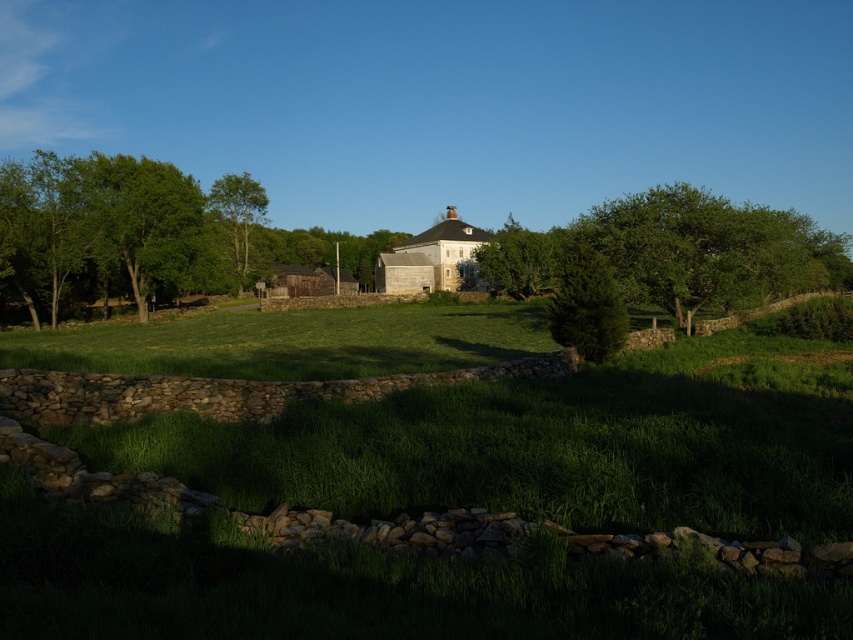
Is green leafy tree at left thinner than green leafy tree at upper right?

In fact, green leafy tree at left might be wider than green leafy tree at upper right.

The image size is (853, 640). I want to click on green leafy tree at left, so click(x=144, y=234).

Where is `green leafy tree at left`? This screenshot has width=853, height=640. green leafy tree at left is located at coordinates [144, 234].

Is point (657, 285) farther from camera compared to point (233, 176)?

No, (657, 285) is closer to viewer.

From the picture: Is green leafy tree at upper right to the right of green leafy tree at upper left from the viewer's perspective?

Indeed, green leafy tree at upper right is positioned on the right side of green leafy tree at upper left.

Locate an element on the screen. The width and height of the screenshot is (853, 640). green leafy tree at upper right is located at coordinates (677, 252).

Where is `green leafy tree at upper right`? green leafy tree at upper right is located at coordinates (677, 252).

Between green leafy tree at center and green leafy tree at upper left, which one is positioned lower?

Positioned lower is green leafy tree at center.

Between green leafy tree at center and green leafy tree at upper left, which one appears on the right side from the viewer's perspective?

From the viewer's perspective, green leafy tree at center appears more on the right side.

Between point (529, 264) and point (225, 220), which one is positioned behind?

The point (225, 220) is behind.

You are a GUI agent. You are given a task and a screenshot of the screen. Output one action in this format:
    pyautogui.click(x=<x>, y=<y>)
    Task: Click on the green leafy tree at center
    The image size is (853, 640).
    Given the screenshot: What is the action you would take?
    pyautogui.click(x=520, y=259)